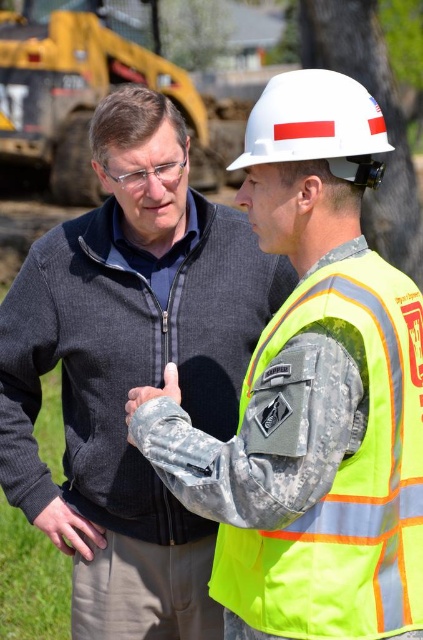
Question: Is yellow metal excavator at upper left thinner than camouflage fabric at center?

Choices:
 (A) yes
 (B) no

Answer: (B)

Question: Among these objects, which one is nearest to the camera?

Choices:
 (A) neon yellow reflective safety vest at right
 (B) white hard hat at center

Answer: (A)

Question: Is yellow metal excavator at upper left below camouflage fabric at center?

Choices:
 (A) yes
 (B) no

Answer: (B)

Question: Which object appears closest to the camera in this image?

Choices:
 (A) yellow metal excavator at upper left
 (B) camouflage fabric at center
 (C) white hard hat at center

Answer: (C)

Question: Estimate the real-world distances between objects in this image. Which object is farther from the neon yellow reflective safety vest at right?

Choices:
 (A) white hard hat at center
 (B) yellow metal excavator at upper left
 (C) camouflage fabric at center

Answer: (B)

Question: Is neon yellow reflective safety vest at right positioned at the back of white hard hat at center?

Choices:
 (A) no
 (B) yes

Answer: (A)